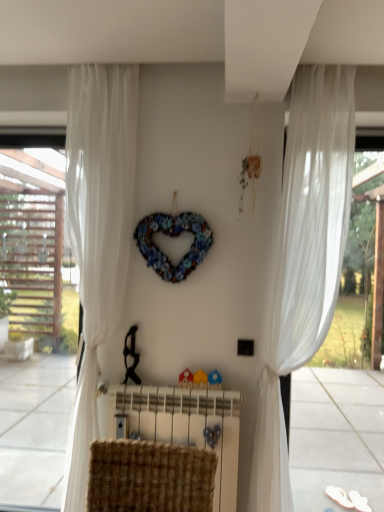
Question: Is multicolored fabric heart at center wider than white sheer curtain at right?

Choices:
 (A) yes
 (B) no

Answer: (B)

Question: Is multicolored fabric heart at center facing towards white sheer curtain at right?

Choices:
 (A) no
 (B) yes

Answer: (A)

Question: Can you confirm if multicolored fabric heart at center is shorter than white sheer curtain at right?

Choices:
 (A) yes
 (B) no

Answer: (A)

Question: From a real-world perspective, is multicolored fabric heart at center positioned over white sheer curtain at right based on gravity?

Choices:
 (A) yes
 (B) no

Answer: (A)

Question: Is multicolored fabric heart at center positioned far away from white sheer curtain at right?

Choices:
 (A) yes
 (B) no

Answer: (B)

Question: Would you say multicolored fabric heart at center contains white sheer curtain at right?

Choices:
 (A) yes
 (B) no

Answer: (B)

Question: Is white sheer curtain at right in front of white sheer curtain at left, which is the 1th curtain in left-to-right order?

Choices:
 (A) yes
 (B) no

Answer: (B)

Question: Does white sheer curtain at right have a greater height compared to white sheer curtain at left, positioned as the second curtain in right-to-left order?

Choices:
 (A) no
 (B) yes

Answer: (B)

Question: Is white sheer curtain at right positioned behind white sheer curtain at left, which is the 1th curtain in left-to-right order?

Choices:
 (A) yes
 (B) no

Answer: (A)

Question: From a real-world perspective, does white sheer curtain at right stand above white sheer curtain at left, positioned as the second curtain in right-to-left order?

Choices:
 (A) no
 (B) yes

Answer: (A)

Question: Does white sheer curtain at right appear on the left side of white sheer curtain at left, which is the 1th curtain in left-to-right order?

Choices:
 (A) yes
 (B) no

Answer: (B)

Question: Is white sheer curtain at right not within white sheer curtain at left, positioned as the second curtain in right-to-left order?

Choices:
 (A) no
 (B) yes

Answer: (B)

Question: Can you confirm if woven fabric radiator at center is bigger than multicolored fabric heart at center?

Choices:
 (A) no
 (B) yes

Answer: (B)